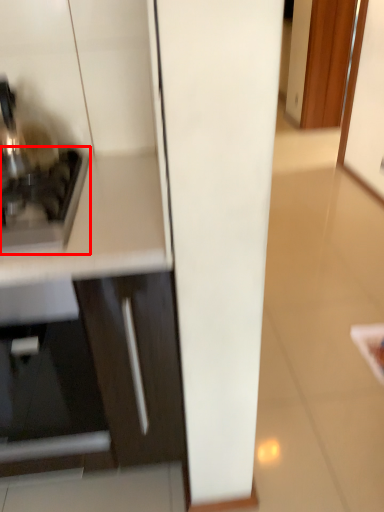
Question: In this image, where is home appliance (annotated by the red box) located relative to cabinetry?

Choices:
 (A) right
 (B) left

Answer: (A)